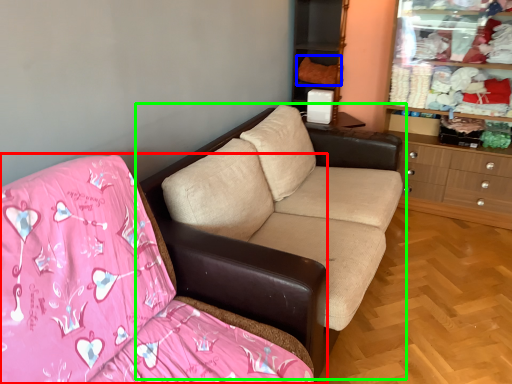
Question: Which is farther away from studio couch (highlighted by a red box)? clothing (highlighted by a blue box) or studio couch (highlighted by a green box)?

Choices:
 (A) clothing
 (B) studio couch

Answer: (A)